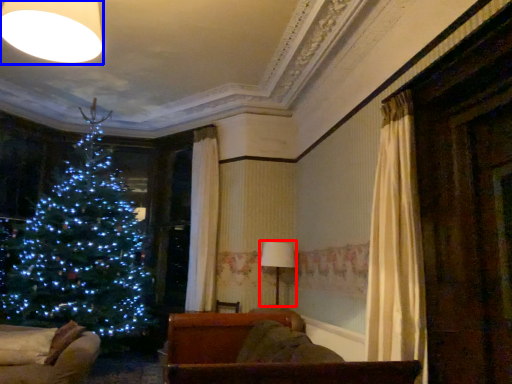
Question: Which object appears farthest to the camera in this image, lamp (highlighted by a red box) or lighting (highlighted by a blue box)?

Choices:
 (A) lamp
 (B) lighting

Answer: (A)